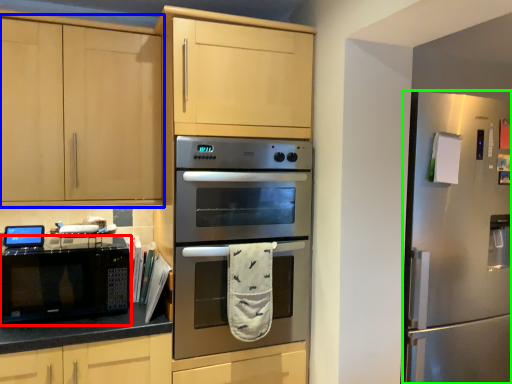
Question: Considering the real-world distances, which object is farthest from microwave oven (highlighted by a red box)? cabinetry (highlighted by a blue box) or refrigerator (highlighted by a green box)?

Choices:
 (A) cabinetry
 (B) refrigerator

Answer: (B)